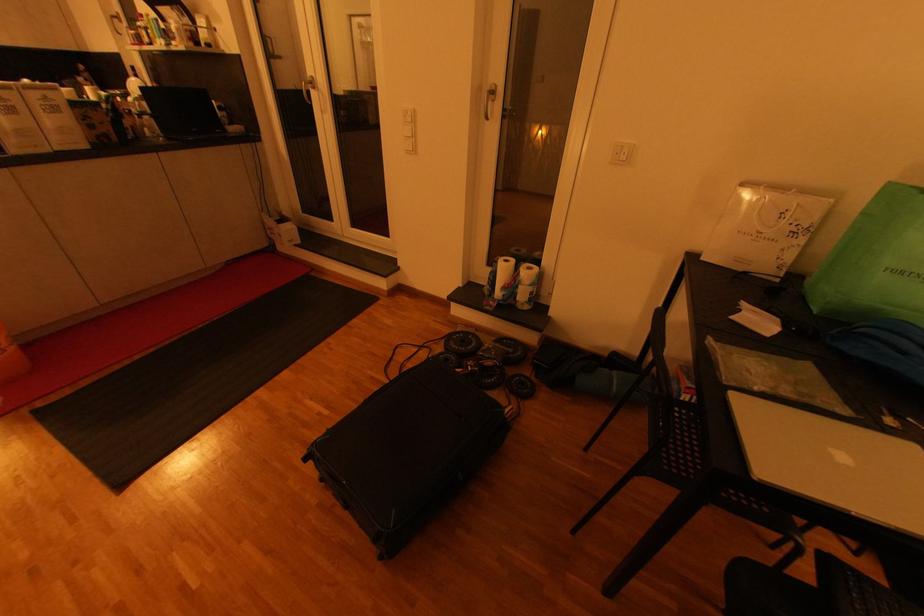
The image size is (924, 616). In order to click on white door handle in this screenshot , I will do `click(307, 89)`.